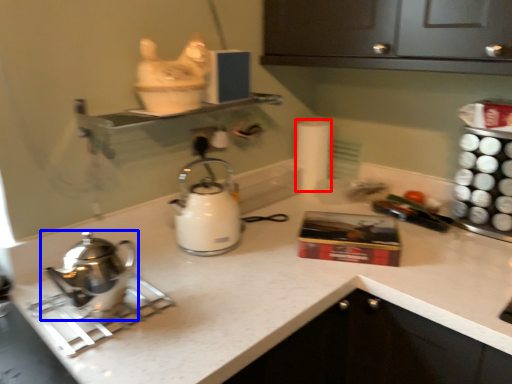
Question: Among these objects, which one is nearest to the camera, toilet paper (highlighted by a red box) or kettle (highlighted by a blue box)?

Choices:
 (A) toilet paper
 (B) kettle

Answer: (B)